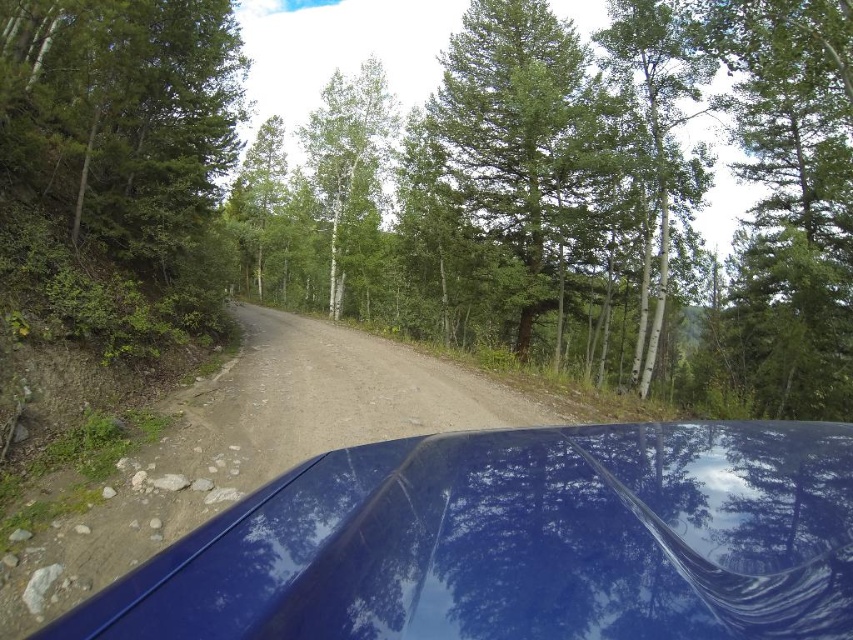
Is green matte tree at center above white bark tree at center?

No.

Between green matte tree at center and white bark tree at center, which one appears on the left side from the viewer's perspective?

Positioned to the left is white bark tree at center.

The image size is (853, 640). What are the coordinates of `green matte tree at center` in the screenshot? It's located at (453, 188).

What are the coordinates of `dirt/gravel road at center` in the screenshot? It's located at (254, 445).

Can you confirm if green smooth bark tree at upper right is smaller than white bark tree at center?

Indeed, green smooth bark tree at upper right has a smaller size compared to white bark tree at center.

Which is more to the right, green smooth bark tree at upper right or white bark tree at center?

green smooth bark tree at upper right

Which is behind, point (672, 67) or point (329, 250)?

Point (329, 250)

I want to click on green smooth bark tree at upper right, so click(659, 125).